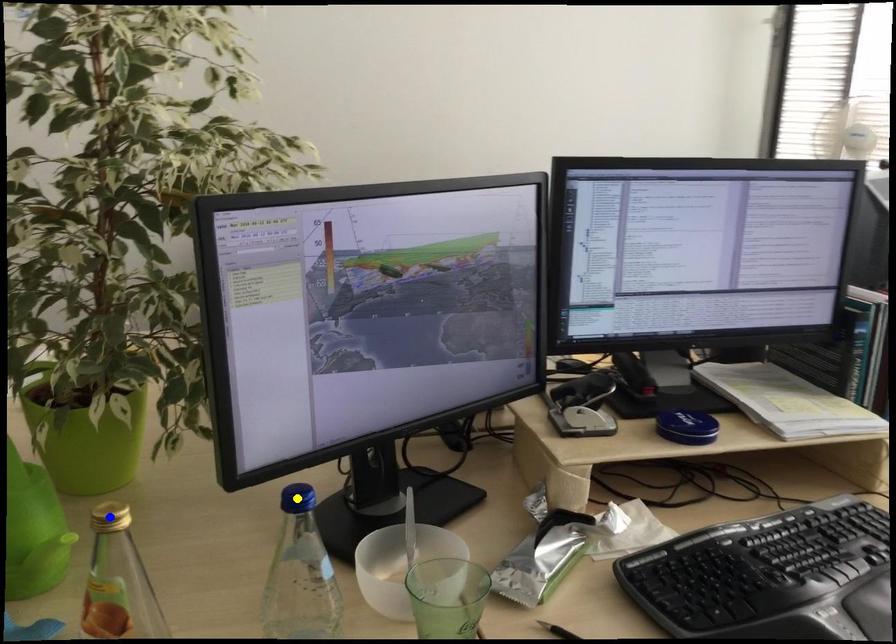
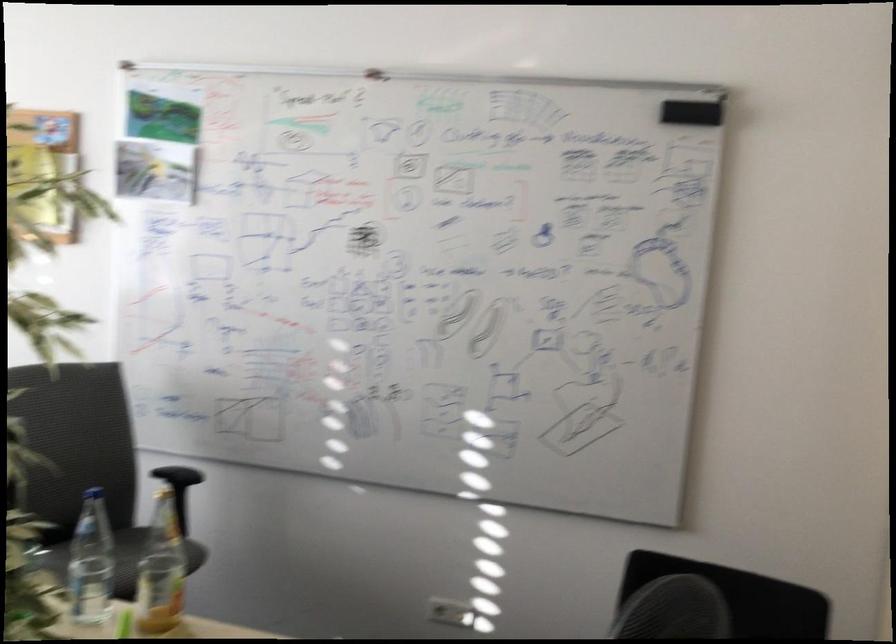
I am providing you with two images of the same scene from different viewpoints. Three points are marked in image1. Which point corresponds to a part or object that is occluded in image2?In image1, three points are marked. Which of them correspond to a part or object that is occluded in image2?Among the three points shown in image1, which one corresponds to a part or object that is no longer visible due to occlusion in image2?

Invisible in image2: green point, yellow point, blue point.